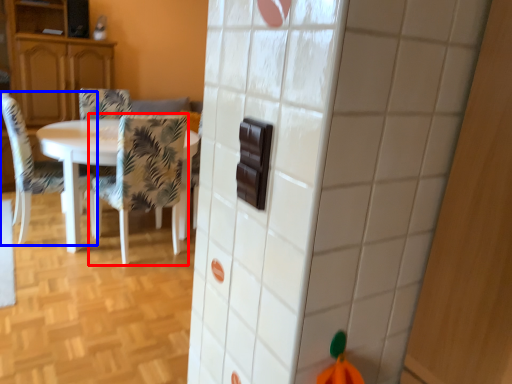
Question: Which object appears farthest to the camera in this image, chair (highlighted by a red box) or chair (highlighted by a blue box)?

Choices:
 (A) chair
 (B) chair

Answer: (B)